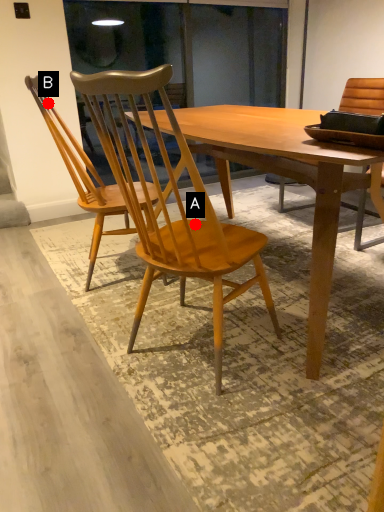
Question: Two points are circled on the image, labeled by A and B beside each circle. Which point is closer to the camera?

Choices:
 (A) A is closer
 (B) B is closer

Answer: (A)